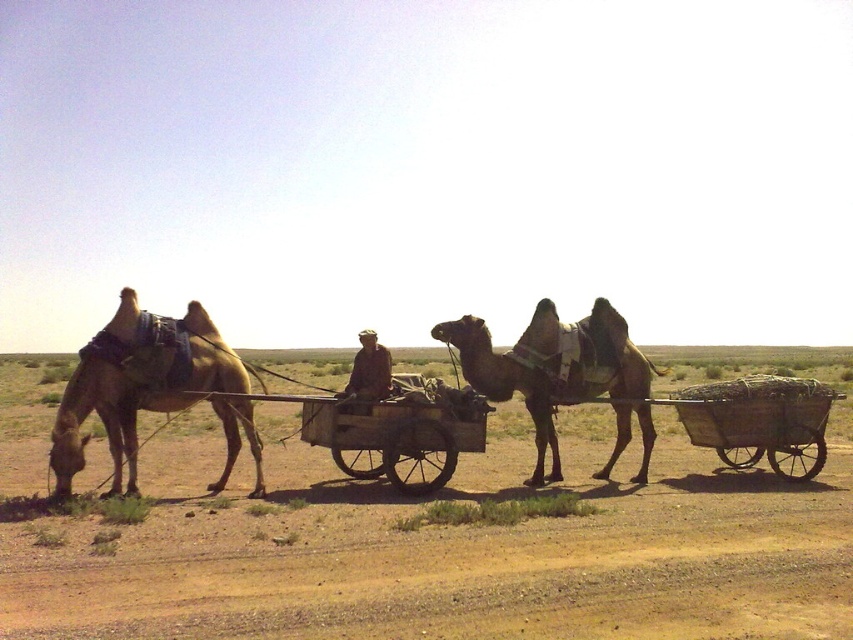
You are a traveler in this desert scene and need to secure your belongings. Which object, the brown textured camel at center or the wooden cart at center, is physically above the other?

The brown textured camel at center is positioned over the wooden cart at center, so the camel is above the cart.

You are a traveler in the desert and need to attach a new water container to the wooden cart at center. Since the brown textured camel at center is already carrying a heavy load, where should you place the container to avoid overburdening the camel?

The wooden cart at center is behind brown textured camel at center, so you should place the container on the wooden cart at center to avoid overburdening the camel.